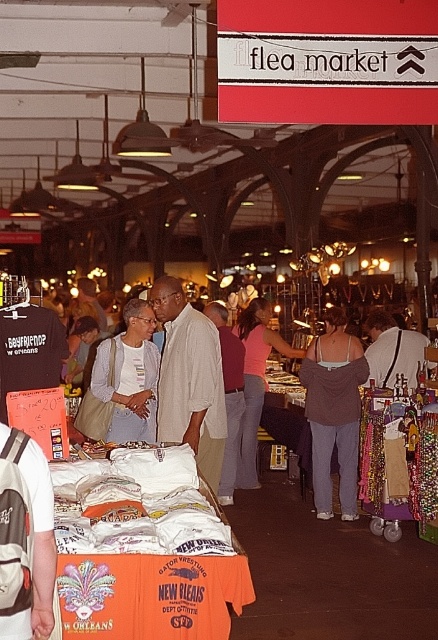
Question: Does light blue denim jacket at center have a smaller size compared to pink fabric tank top at center?

Choices:
 (A) yes
 (B) no

Answer: (A)

Question: Which of the following is the closest to the observer?

Choices:
 (A) (137, 310)
 (B) (313, 476)
 (C) (265, 348)
 (D) (215, 467)

Answer: (D)

Question: Is beige cotton shirt at center bigger than light blue denim jacket at center?

Choices:
 (A) yes
 (B) no

Answer: (A)

Question: Can you confirm if matte gray tank top at center is bigger than light blue denim jacket at center?

Choices:
 (A) no
 (B) yes

Answer: (B)

Question: Which object is positioned farthest from the light blue denim jacket at center?

Choices:
 (A) pink fabric tank top at center
 (B) matte gray tank top at center
 (C) beige cotton shirt at center

Answer: (A)

Question: Which of these objects is positioned farthest from the matte gray tank top at center?

Choices:
 (A) pink fabric tank top at center
 (B) light blue denim jacket at center
 (C) beige cotton shirt at center

Answer: (B)